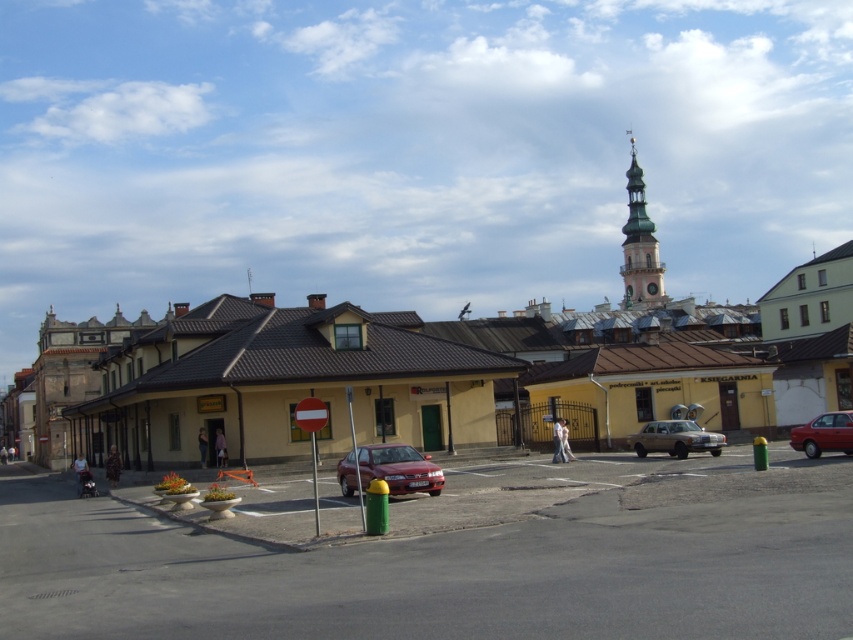
Question: Based on their relative distances, which object is nearer to the shiny red sedan at lower right?

Choices:
 (A) shiny red sedan at center
 (B) green stone clock tower at upper right
 (C) yellow matte building at center
 (D) gold metallic sedan at center-right

Answer: (D)

Question: Where is yellow matte building at center located in relation to green stone clock tower at upper right in the image?

Choices:
 (A) above
 (B) below

Answer: (B)

Question: Which of the following is the farthest from the observer?

Choices:
 (A) (370, 468)
 (B) (654, 288)
 (C) (143, 412)
 (D) (798, 444)

Answer: (B)

Question: Which of these objects is positioned closest to the shiny red sedan at lower right?

Choices:
 (A) gold metallic sedan at center-right
 (B) shiny red sedan at center

Answer: (A)

Question: Can you confirm if gold metallic sedan at center-right is bigger than shiny red sedan at lower right?

Choices:
 (A) yes
 (B) no

Answer: (B)

Question: Does gold metallic sedan at center-right lie behind shiny red sedan at lower right?

Choices:
 (A) no
 (B) yes

Answer: (B)